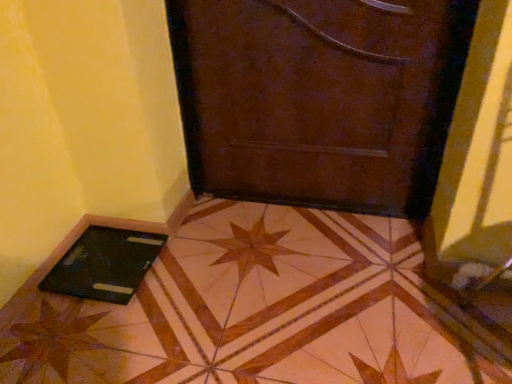
What are the coordinates of `vacant location below black matte tablet at lower left (from a real-world perspective)` in the screenshot? It's located at [x=92, y=267].